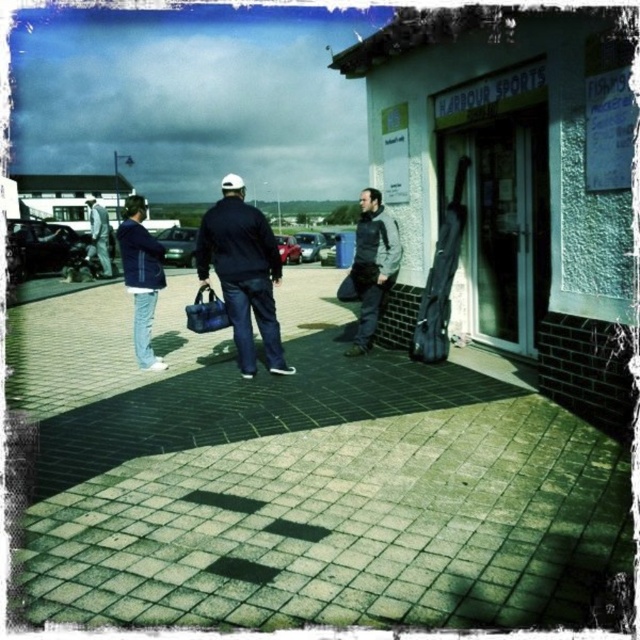
You are standing at the entrance of the Harbour Sports building and want to walk to the green brick pavement at center located at point (304, 480). Which direction should you head towards?

You should head towards the center of the image to reach the green brick pavement at center located at point (304, 480).

You are trying to decide where to place a small potted plant. You have two options near the entrance of Harbour Sports building. One spot is on the green brick pavement at center and the other is near the matte blue jacket at left. Which location will allow the plant to be more visible to people entering the building?

The matte blue jacket at left is taller than the green brick pavement at center. Therefore, placing the plant near the matte blue jacket at left would make it more visible to people entering the building since it is elevated higher than the pavement.

You are standing at the entrance of the Harbour Sports building and see the dark gray jacket at center and the blue denim jacket at left. Which jacket is positioned higher relative to the other?

The dark gray jacket at center is positioned higher than the blue denim jacket at left.